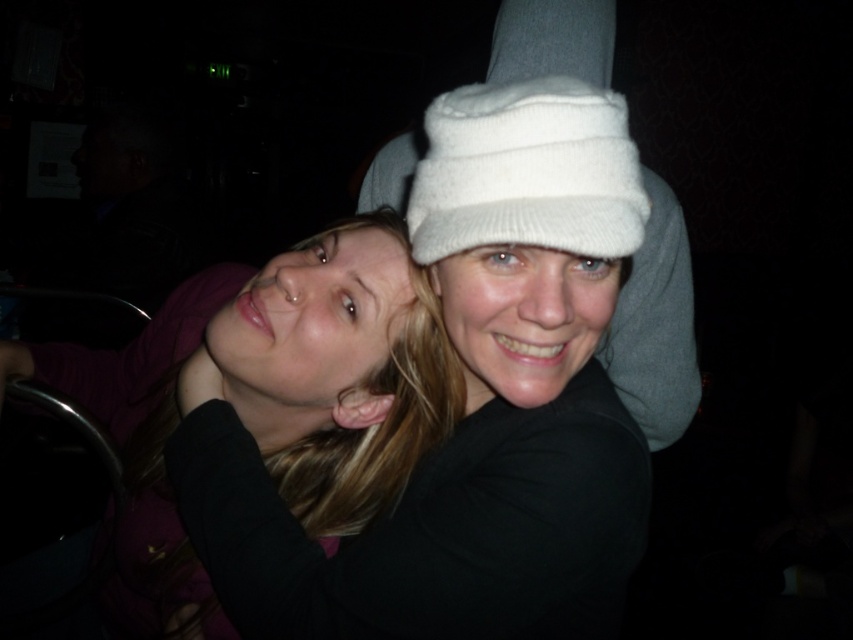
Question: Among these objects, which one is farthest from the camera?

Choices:
 (A) white knitted hat at center
 (B) matte black hair at center
 (C) white knitted hat at upper center

Answer: (C)

Question: Is matte black hair at center smaller than white knitted hat at upper center?

Choices:
 (A) yes
 (B) no

Answer: (A)

Question: Does white knitted hat at center appear under white knitted hat at upper center?

Choices:
 (A) yes
 (B) no

Answer: (B)

Question: Which is nearer to the white knitted hat at center?

Choices:
 (A) matte black hair at center
 (B) white knitted hat at upper center

Answer: (A)

Question: Which object is positioned farthest from the white knitted hat at center?

Choices:
 (A) matte black hair at center
 (B) white knitted hat at upper center

Answer: (B)

Question: Does white knitted hat at center lie behind white knitted hat at upper center?

Choices:
 (A) yes
 (B) no

Answer: (B)